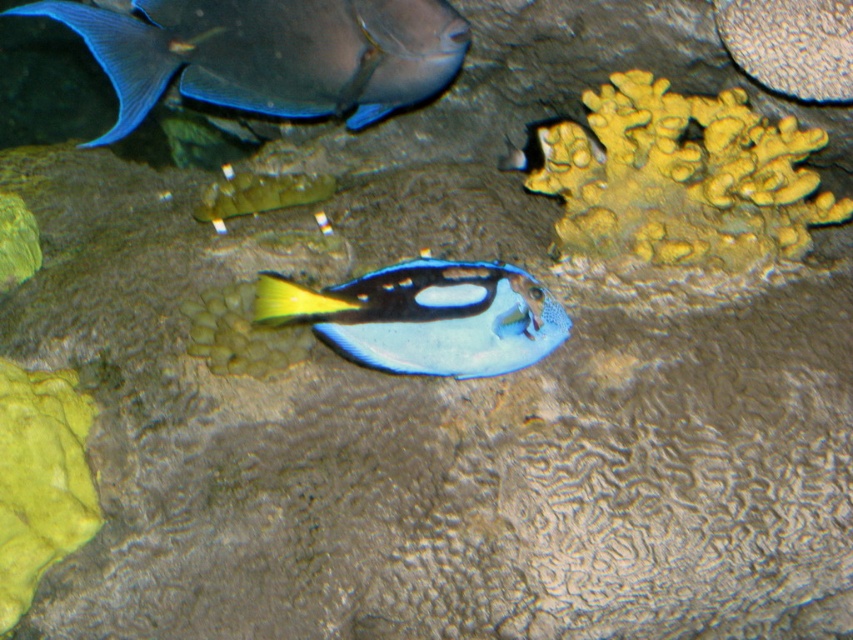
Question: Is shiny blue fish at upper left below blue glossy fish at center?

Choices:
 (A) yes
 (B) no

Answer: (B)

Question: Does shiny blue fish at upper left have a smaller size compared to blue glossy fish at center?

Choices:
 (A) yes
 (B) no

Answer: (B)

Question: Which object is the closest to the shiny blue fish at upper left?

Choices:
 (A) blue glossy fish at center
 (B) yellow porous coral at upper right

Answer: (A)

Question: Is yellow porous coral at upper right thinner than shiny blue fish at upper left?

Choices:
 (A) yes
 (B) no

Answer: (A)

Question: Among these points, which one is nearest to the camera?

Choices:
 (A) (426, 321)
 (B) (250, 35)
 (C) (547, 150)

Answer: (A)

Question: Based on their relative distances, which object is nearer to the shiny blue fish at upper left?

Choices:
 (A) yellow porous coral at upper right
 (B) blue glossy fish at center

Answer: (B)